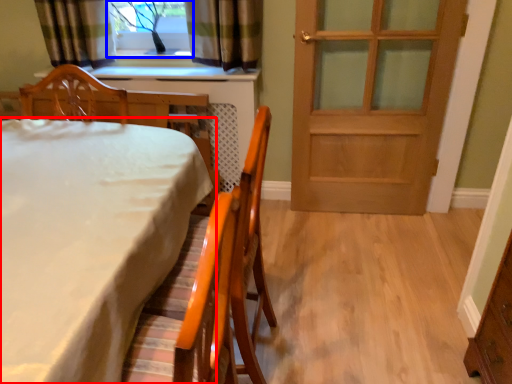
Question: Which object appears farthest to the camera in this image, table (highlighted by a red box) or window (highlighted by a blue box)?

Choices:
 (A) table
 (B) window

Answer: (B)